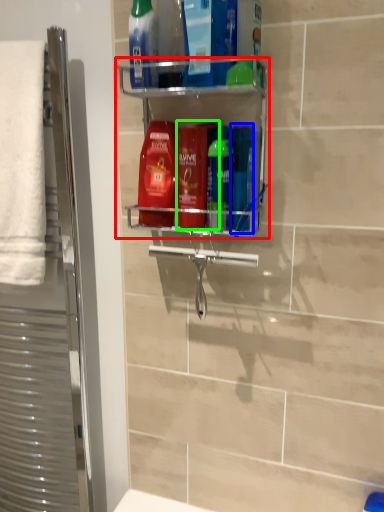
Question: Based on their relative distances, which object is nearer to shelf (highlighted by a red box)? Choose from mouthwash (highlighted by a blue box) and mouthwash (highlighted by a green box).

Choices:
 (A) mouthwash
 (B) mouthwash

Answer: (B)